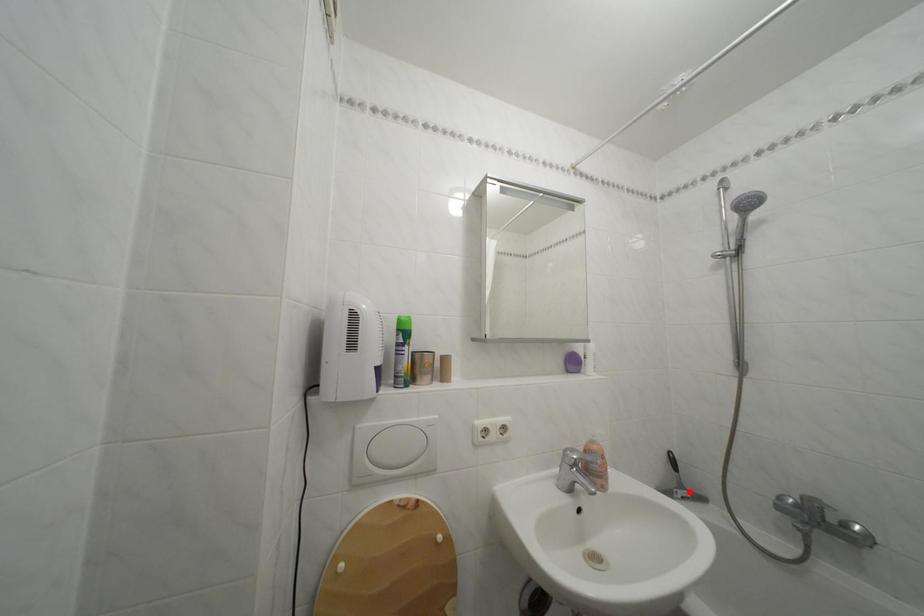
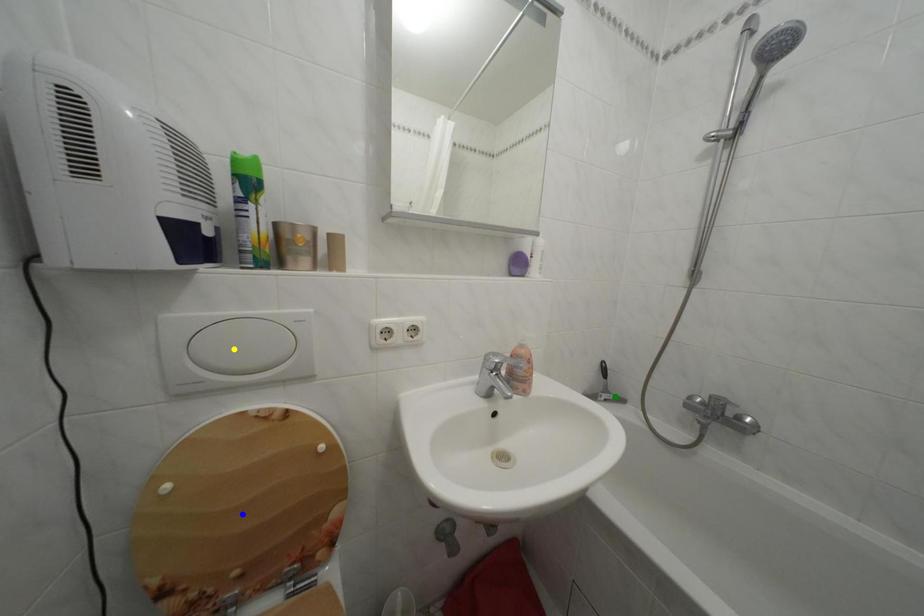
Question: I am providing you with two images of the same scene from different viewpoints. A red point is marked on the first image. You are given multiple points on the second image. Which spot in image 2 lines up with the point in image 1?

Choices:
 (A) yellow point
 (B) blue point
 (C) green point

Answer: (C)